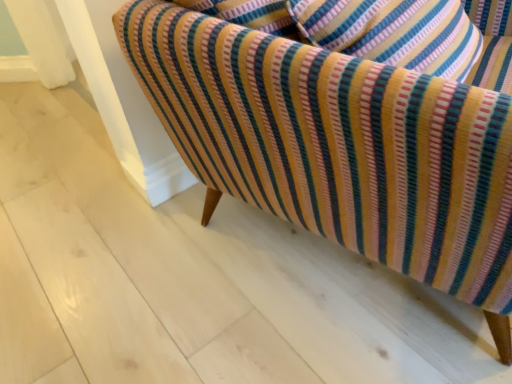
Question: Should I look upward or downward to see striped fabric sofa at center?

Choices:
 (A) up
 (B) down

Answer: (A)